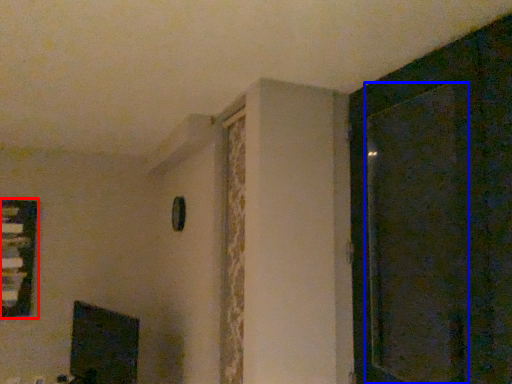
Question: Which point is closer to the camera, window (highlighted by a red box) or screen door (highlighted by a blue box)?

Choices:
 (A) window
 (B) screen door

Answer: (B)